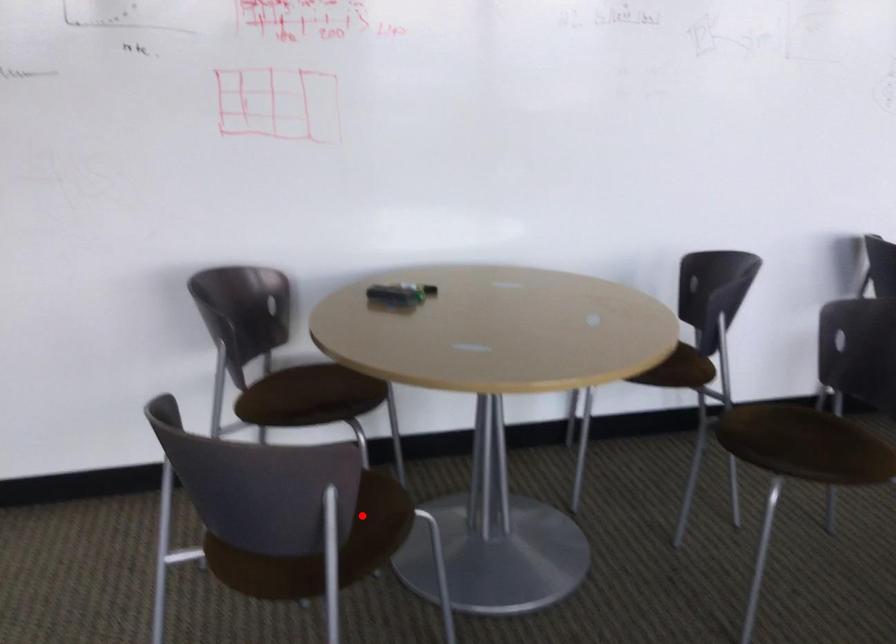
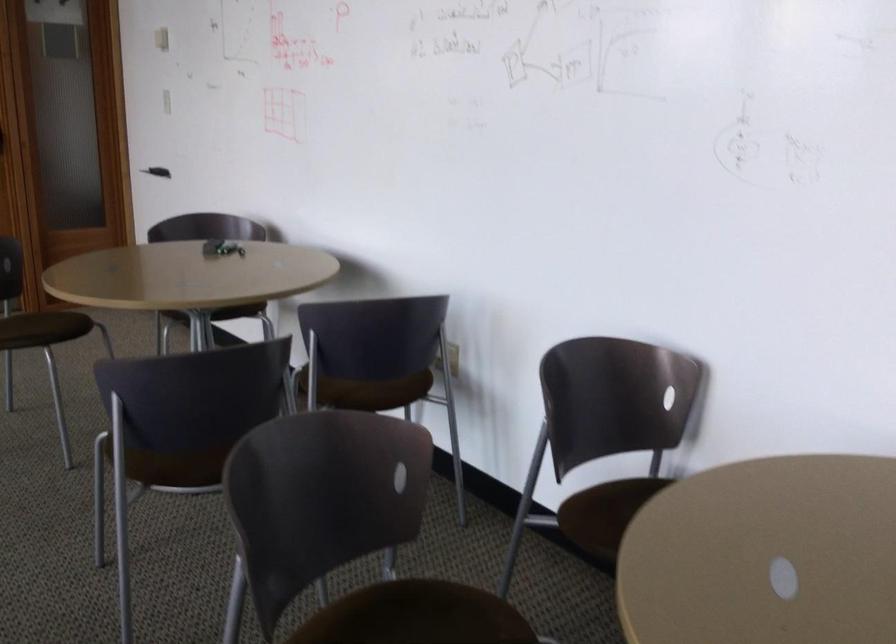
Question: A red point is marked in image1. In image2, is the corresponding 3D point closer to the camera or farther? Reply with the corresponding letter.

Choices:
 (A) The corresponding 3D point is closer.
 (B) The corresponding 3D point is farther.

Answer: (B)